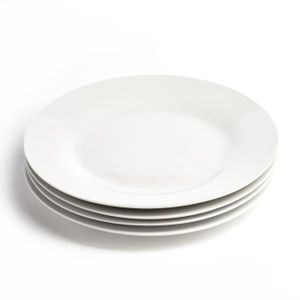
Where is `plates`? The width and height of the screenshot is (300, 300). plates is located at coordinates (151, 180), (147, 216), (146, 223), (150, 233).